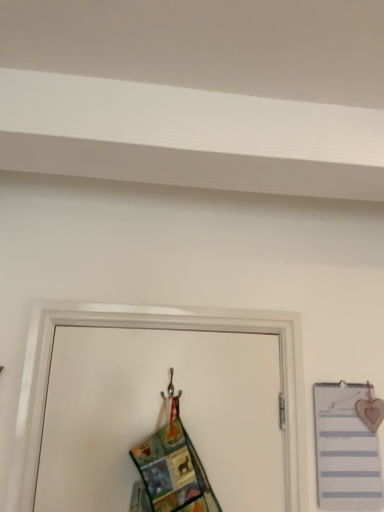
What do you see at coordinates (171, 471) in the screenshot?
I see `multicolored fabric at center` at bounding box center [171, 471].

In order to face multicolored fabric at center, should I rotate leftwards or rightwards?

To face it directly, rotate left by 1.379 degrees.

Locate an element on the screen. This screenshot has width=384, height=512. multicolored fabric at center is located at coordinates (171, 471).

Where is `white striped notebook at right`? The width and height of the screenshot is (384, 512). white striped notebook at right is located at coordinates (345, 450).

The width and height of the screenshot is (384, 512). What do you see at coordinates (345, 450) in the screenshot? I see `white striped notebook at right` at bounding box center [345, 450].

Identify the location of multicolored fabric at center. This screenshot has height=512, width=384. (171, 471).

Based on the photo, which object is positioned more to the right, multicolored fabric at center or white striped notebook at right?

white striped notebook at right is more to the right.

Between multicolored fabric at center and white striped notebook at right, which one is positioned behind?

white striped notebook at right is behind.

Which point is more forward, (138, 467) or (336, 455)?

Point (138, 467)

Looking at this image, from the image's perspective, who appears lower, multicolored fabric at center or white striped notebook at right?

white striped notebook at right, from the image's perspective.

From a real-world perspective, is multicolored fabric at center located beneath white striped notebook at right?

Indeed, from a real-world perspective, multicolored fabric at center is positioned beneath white striped notebook at right.

Is multicolored fabric at center thinner than white striped notebook at right?

In fact, multicolored fabric at center might be wider than white striped notebook at right.

Is multicolored fabric at center shorter than white striped notebook at right?

Yes, multicolored fabric at center is shorter than white striped notebook at right.

Considering the relative sizes of multicolored fabric at center and white striped notebook at right in the image provided, is multicolored fabric at center smaller than white striped notebook at right?

Actually, multicolored fabric at center might be larger than white striped notebook at right.

Which is correct: multicolored fabric at center is inside white striped notebook at right, or outside of it?

multicolored fabric at center lies outside white striped notebook at right.

Would you say multicolored fabric at center is a long distance from white striped notebook at right?

That's not correct — multicolored fabric at center is a little close to white striped notebook at right.

Is multicolored fabric at center turned away from white striped notebook at right?

No, multicolored fabric at center is not facing the opposite direction of white striped notebook at right.

Can you tell me how much multicolored fabric at center and white striped notebook at right differ in facing direction?

multicolored fabric at center and white striped notebook at right are facing 1.42 degrees away from each other.

Find the location of a particular element. notebook located on the right of multicolored fabric at center is located at coordinates (345, 450).

Would you say white striped notebook at right is to the left or to the right of multicolored fabric at center in the picture?

Based on their positions, white striped notebook at right is located to the right of multicolored fabric at center.

In the image, is white striped notebook at right positioned in front of or behind multicolored fabric at center?

white striped notebook at right is behind multicolored fabric at center.

Which is closer to the camera, (341, 388) or (197, 500)?

Point (341, 388) is positioned farther from the camera compared to point (197, 500).

From the picture: From the image's perspective, is white striped notebook at right on multicolored fabric at center?

No, from the image's perspective, white striped notebook at right is not over multicolored fabric at center.

From a real-world perspective, relative to multicolored fabric at center, is white striped notebook at right vertically above or below?

white striped notebook at right is above multicolored fabric at center.

Looking at their sizes, would you say white striped notebook at right is wider or thinner than multicolored fabric at center?

Clearly, white striped notebook at right has less width compared to multicolored fabric at center.

Which of these two, white striped notebook at right or multicolored fabric at center, stands taller?

white striped notebook at right.

Considering the relative sizes of white striped notebook at right and multicolored fabric at center in the image provided, is white striped notebook at right bigger than multicolored fabric at center?

Actually, white striped notebook at right might be smaller than multicolored fabric at center.

Would you say multicolored fabric at center is part of white striped notebook at right's contents?

No, multicolored fabric at center is not inside white striped notebook at right.

Is white striped notebook at right not close to multicolored fabric at center?

No, white striped notebook at right is not far away from multicolored fabric at center.

Is white striped notebook at right aimed at multicolored fabric at center?

No, white striped notebook at right is not facing towards multicolored fabric at center.

Locate an element on the screen. fancy dress in front of the white striped notebook at right is located at coordinates click(171, 471).

The width and height of the screenshot is (384, 512). In the image, there is a white striped notebook at right. Find the location of `fancy dress above it (from the image's perspective)`. fancy dress above it (from the image's perspective) is located at coordinates (171, 471).

The height and width of the screenshot is (512, 384). Find the location of `fancy dress on the left of white striped notebook at right`. fancy dress on the left of white striped notebook at right is located at coordinates (171, 471).